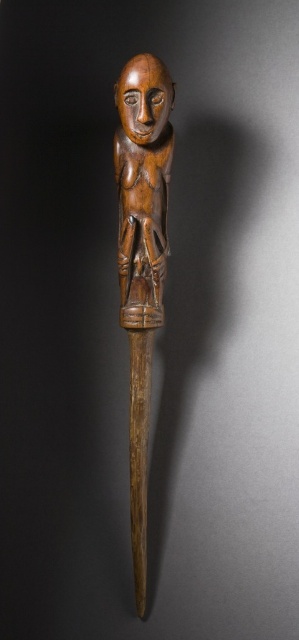
Is the position of wooden carving at center more distant than that of wooden figurine at center?

Yes, it is behind wooden figurine at center.

Looking at this image, can you confirm if wooden carving at center is bigger than wooden figurine at center?

Yes.

What do you see at coordinates (142, 259) in the screenshot? I see `wooden carving at center` at bounding box center [142, 259].

The width and height of the screenshot is (299, 640). I want to click on wooden carving at center, so click(142, 259).